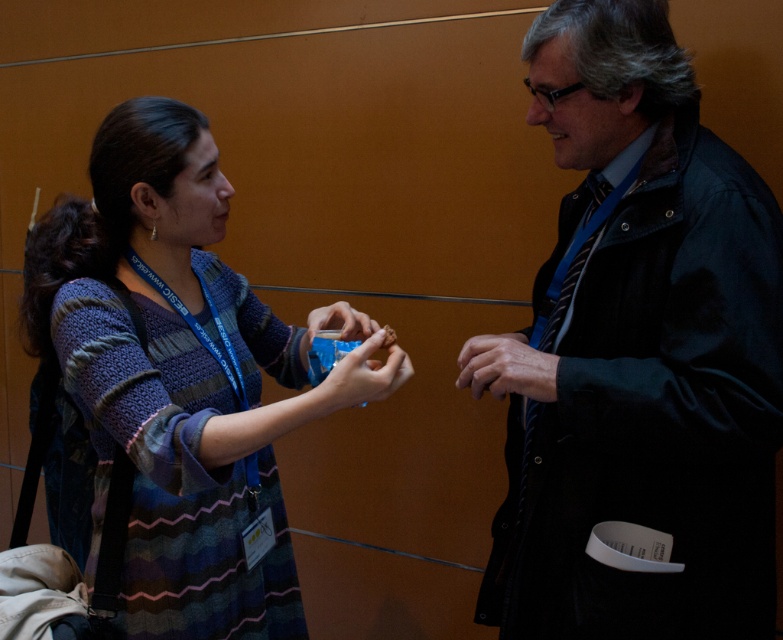
You are a photographer standing behind the two people in the image. You want to take a photo that includes both the dark blue jacket at center and the matte plastic cup at center. Which object should you focus on first to ensure both are in the frame?

The dark blue jacket at center is located below the matte plastic cup at center, so you should focus on the matte plastic cup at center first to ensure both are in the frame.

You are organizing a craft fair and need to display items in order of size from largest to smallest. You have a knitted sweater at center and a matte plastic cookie at center. Which should you place first?

The knitted sweater at center should be placed first since its width is larger than the matte plastic cookie at center.

You are a photographer setting up a tripod in the center of the image. You notice the dry skin at center and the matte plastic cup at center. Which object should you adjust your focus on if you want to capture the taller object?

The dry skin at center is taller than the matte plastic cup at center, so you should focus on the dry skin at center.